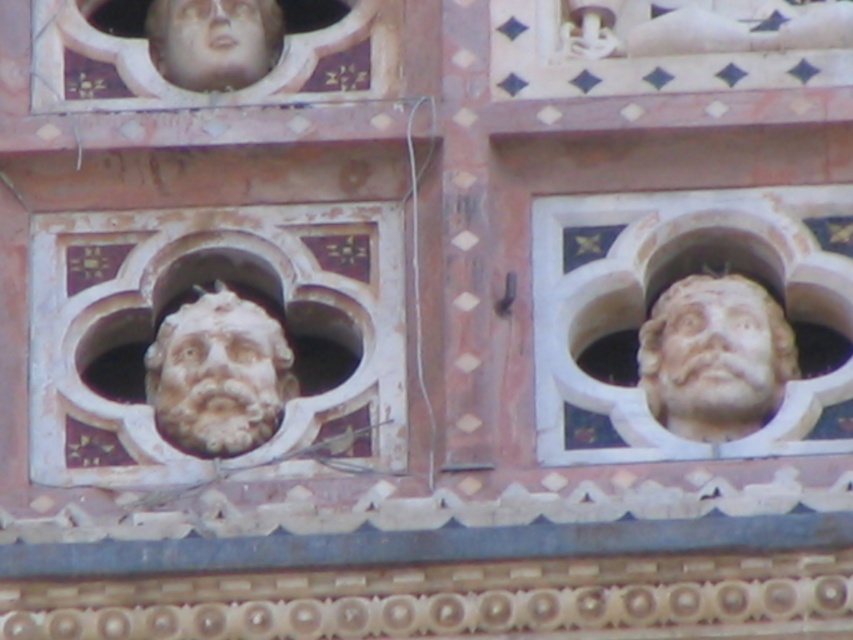
You are an architect examining the image of the ornate architectural detail. You need to locate the white stone face at center. What are its coordinates in the image?

The white stone face at center is located at coordinates point (218, 372).